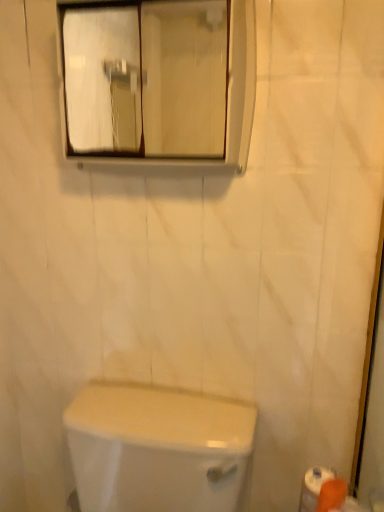
Locate an element on the screen. The width and height of the screenshot is (384, 512). free space above white glossy toilet at lower center (from a real-world perspective) is located at coordinates (150, 415).